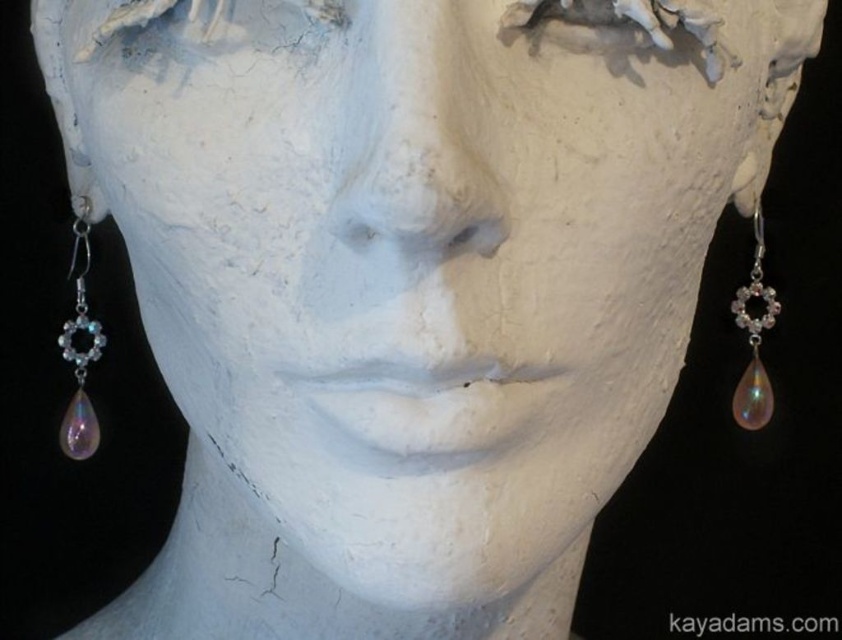
Question: Which of the following is the closest to the observer?

Choices:
 (A) (758, 326)
 (B) (75, 256)

Answer: (A)

Question: Which point is closer to the camera taking this photo?

Choices:
 (A) (76, 285)
 (B) (749, 275)

Answer: (B)

Question: Is iridescent glass teardrop at left wider than iridescent glass teardrop at right?

Choices:
 (A) no
 (B) yes

Answer: (B)

Question: Can you confirm if iridescent glass teardrop at left is thinner than iridescent glass teardrop at right?

Choices:
 (A) yes
 (B) no

Answer: (B)

Question: Can you confirm if iridescent glass teardrop at left is bigger than iridescent glass teardrop at right?

Choices:
 (A) yes
 (B) no

Answer: (A)